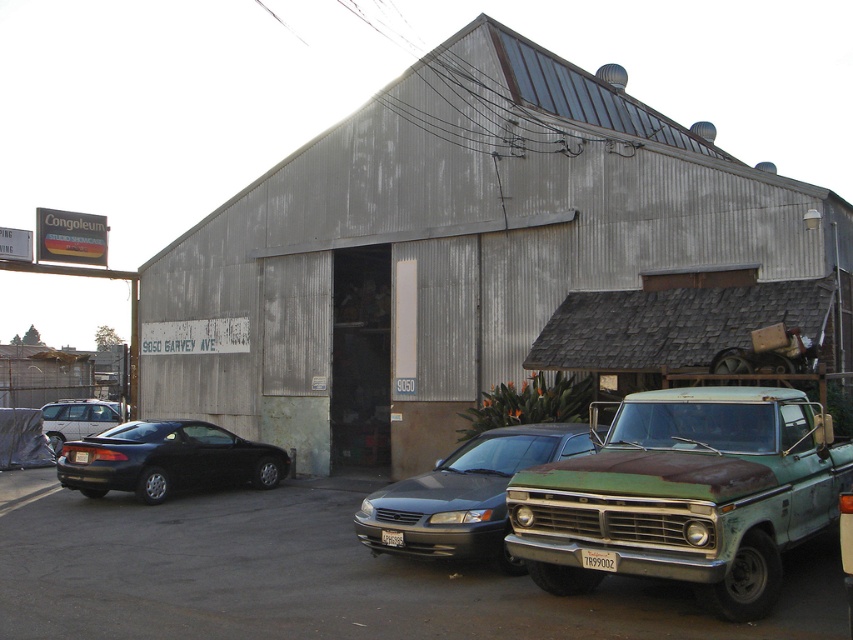
Question: Which point is closer to the camera taking this photo?

Choices:
 (A) (49, 422)
 (B) (76, 525)
 (C) (764, 388)
 (D) (190, 468)

Answer: (C)

Question: Which object is positioned closest to the rusty corrugated metal barn at center?

Choices:
 (A) matte black sedan at center
 (B) shiny black car at center
 (C) rusty green pickup truck at lower right
 (D) matte silver van at left

Answer: (B)

Question: Which of these objects is positioned farthest from the matte black car at left?

Choices:
 (A) matte black sedan at center
 (B) shiny black car at center

Answer: (A)

Question: Can you confirm if rusty green pickup truck at lower right is wider than matte silver van at left?

Choices:
 (A) yes
 (B) no

Answer: (B)

Question: Does rusty corrugated metal barn at center have a larger size compared to matte silver van at left?

Choices:
 (A) no
 (B) yes

Answer: (B)

Question: Can you confirm if shiny black car at center is positioned above matte black car at left?

Choices:
 (A) no
 (B) yes

Answer: (A)